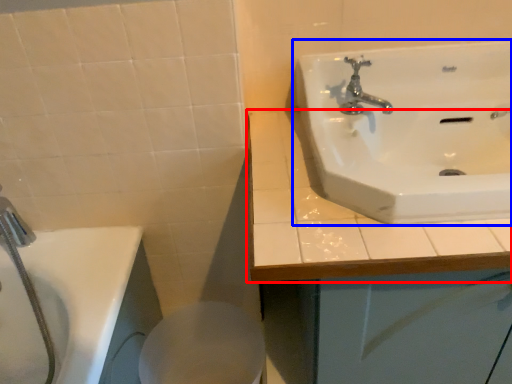
Question: Which of the following is the farthest to the observer, counter top (highlighted by a red box) or sink (highlighted by a blue box)?

Choices:
 (A) counter top
 (B) sink

Answer: (A)